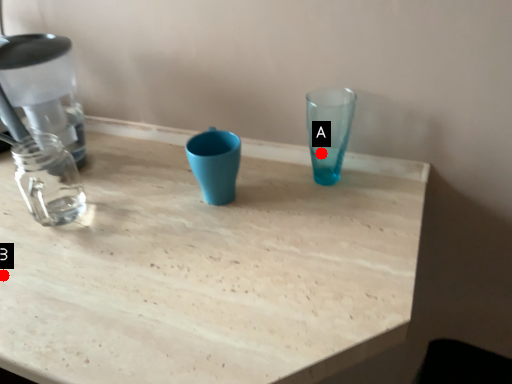
Question: Two points are circled on the image, labeled by A and B beside each circle. Which point is farther from the camera taking this photo?

Choices:
 (A) A is further
 (B) B is further

Answer: (A)